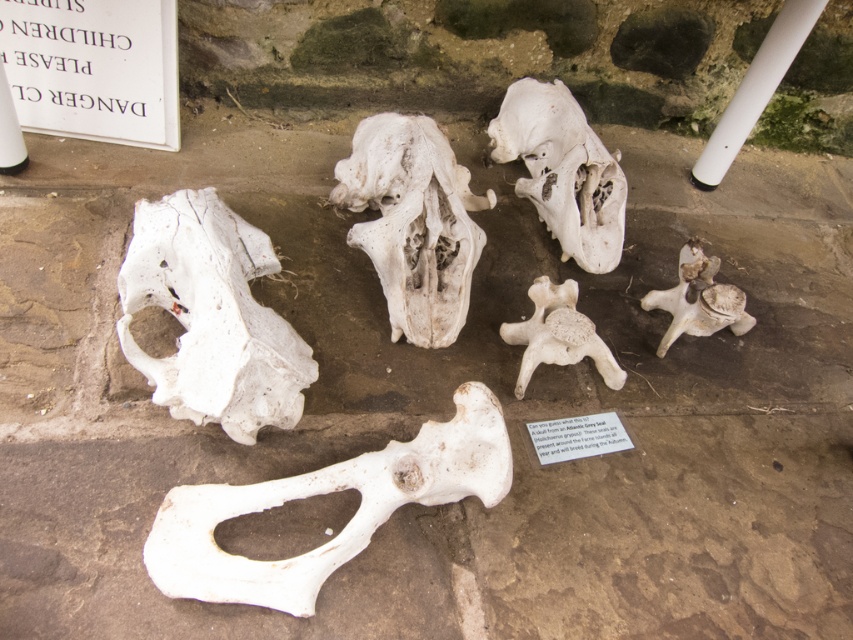
Looking at this image, is white bone at center closer to camera compared to white porous skull at upper center?

That is True.

Does point (350, 467) lie in front of point (563, 136)?

Yes, point (350, 467) is closer to viewer.

Who is more forward, (202, 556) or (624, 200)?

Point (202, 556) is more forward.

The height and width of the screenshot is (640, 853). I want to click on white bone at center, so click(x=323, y=493).

This screenshot has width=853, height=640. I want to click on white matte skull at left, so click(x=212, y=316).

Can you confirm if white matte skull at left is positioned below white porous bone at center?

Indeed, white matte skull at left is positioned under white porous bone at center.

Locate an element on the screen. Image resolution: width=853 pixels, height=640 pixels. white matte skull at left is located at coordinates (212, 316).

Identify the location of white matte skull at left. The height and width of the screenshot is (640, 853). (212, 316).

Between white matte skull at left and white bone at center, which one is positioned lower?

Positioned lower is white bone at center.

What do you see at coordinates (212, 316) in the screenshot? The image size is (853, 640). I see `white matte skull at left` at bounding box center [212, 316].

The image size is (853, 640). Identify the location of white matte skull at left. (212, 316).